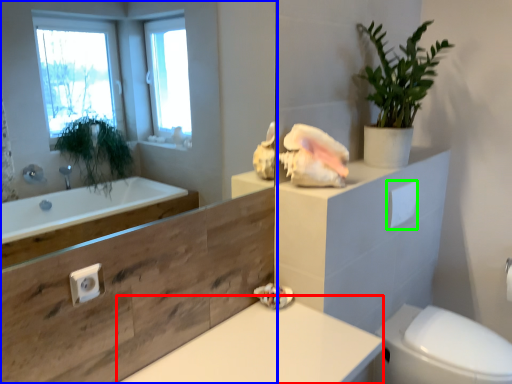
Question: Which object is the closest to the counter top (highlighted by a red box)? Choose among these: mirror (highlighted by a blue box) or toilet paper (highlighted by a green box).

Choices:
 (A) mirror
 (B) toilet paper

Answer: (B)